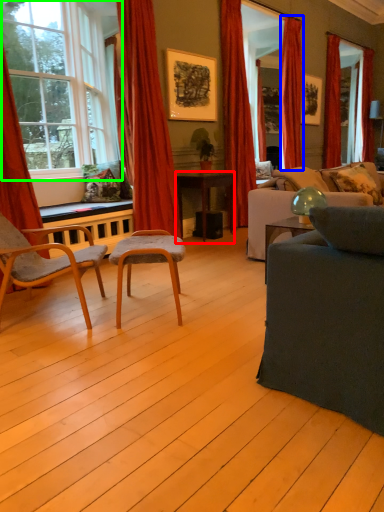
Question: Which object is the closest to the desk (highlighted by a red box)? Choose among these: curtain (highlighted by a blue box) or window (highlighted by a green box).

Choices:
 (A) curtain
 (B) window

Answer: (A)